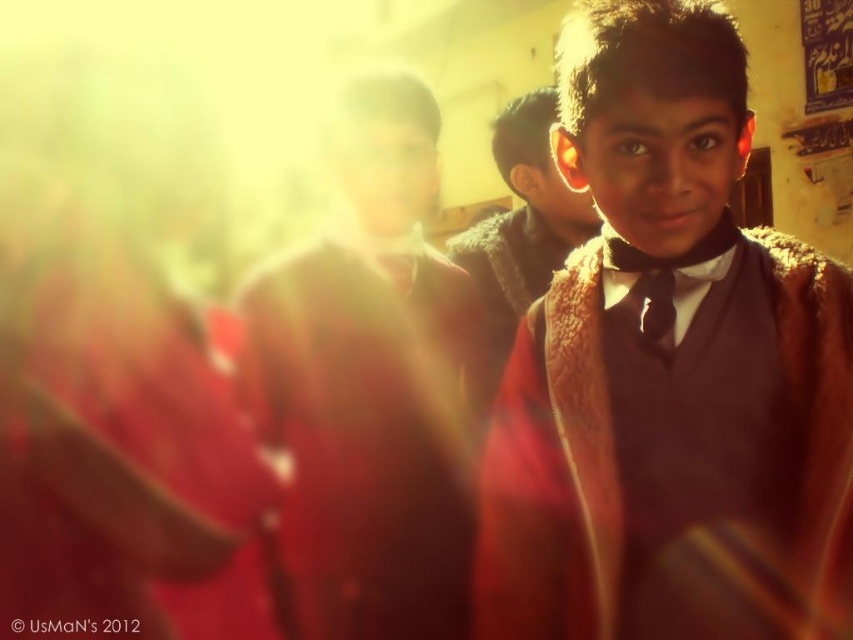
You are standing in the school scene described. There is a point at coordinates (519, 230). What object is located at that point?

The point at coordinates (519, 230) corresponds to the brown fuzzy coat at center.

You are a tailor observing the scene. The brown woolen sweater at center and the black satin tie at center are both in need of alterations. Which item requires a longer vertical adjustment to ensure proper fit?

The brown woolen sweater at center requires a longer vertical adjustment because it has a greater height compared to the black satin tie at center.

You are a photographer adjusting the focus on your camera. You want to ensure both the brown fuzzy coat at center and the black satin tie at center are in focus. Given their positions, is it possible to adjust the focus so both are clear?

The brown fuzzy coat at center is further to the viewer than the black satin tie at center. Since the coat is closer to the camera, adjusting the focus to the coat would keep it sharp, but the tie might be slightly out of focus. To get both in focus, you might need to adjust the focus point to a midpoint between them or use a smaller aperture for greater depth of field.